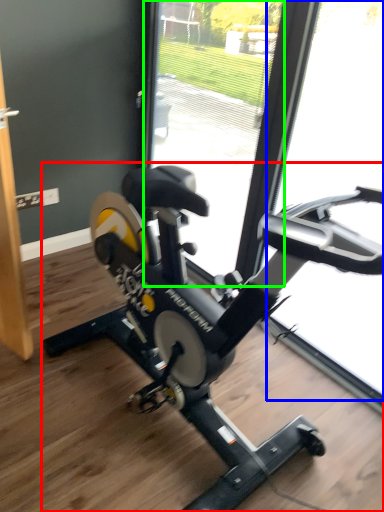
Question: Which is nearer to the stationary bicycle (highlighted by a red box)? glass door (highlighted by a blue box) or glass door (highlighted by a green box).

Choices:
 (A) glass door
 (B) glass door

Answer: (A)